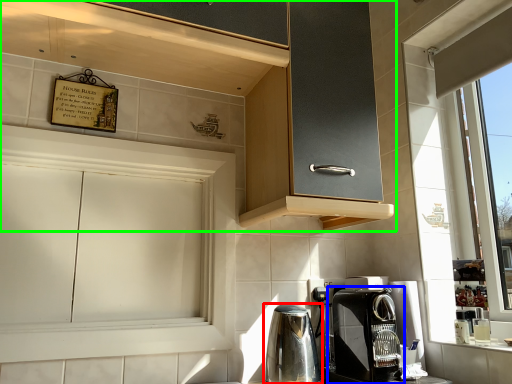
Question: Which is farther away from home appliance (highlighted by a red box)? coffee maker (highlighted by a blue box) or cabinetry (highlighted by a green box)?

Choices:
 (A) coffee maker
 (B) cabinetry

Answer: (B)